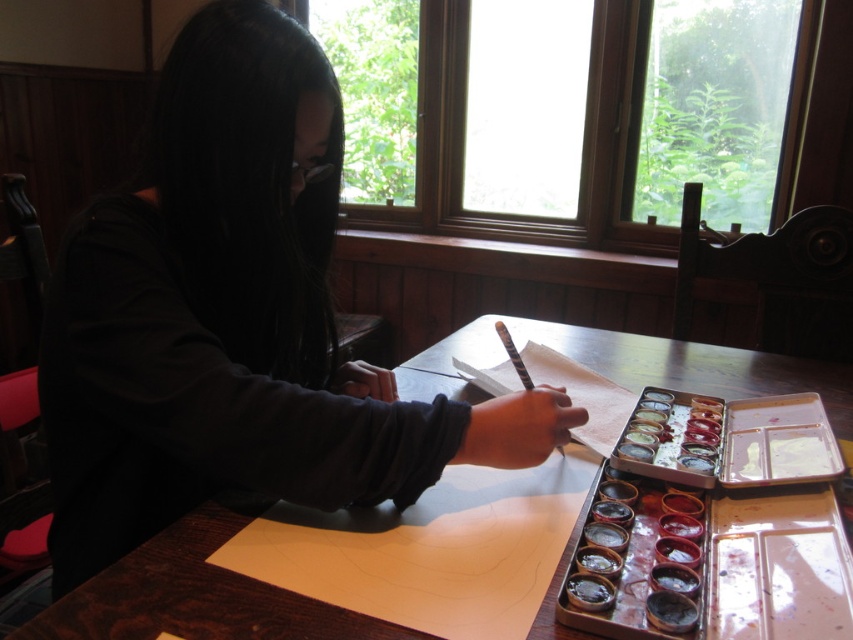
You are an art student who wants to place a new paintbrush on the wooden table at center. However, the black textured paintbrush at center is already occupying the space. Can you move the black textured paintbrush to the left to make room?

The wooden table at center is to the right of the black textured paintbrush at center, so moving the black textured paintbrush at center to the left would place it further away from the wooden table at center. Therefore, you can move the black textured paintbrush at center to the left to make space on the wooden table at center.

You have a small toy car that is 10 cm long. You want to place it on the wooden table at center. Considering the table and the black textured paintbrush at center, can the toy car fit on the table without overlapping the paintbrush?

The wooden table at center is wider than the black textured paintbrush at center. Since the table is wider, there should be enough space to place the 10 cm toy car without overlapping the paintbrush, provided the car is positioned appropriately.

You are an art student observing the scene. You need to determine which object is wider between the matte black shirt at center and the black textured paintbrush at center. Can you compare their widths?

The matte black shirt at center is wider than the black textured paintbrush at center according to the description.